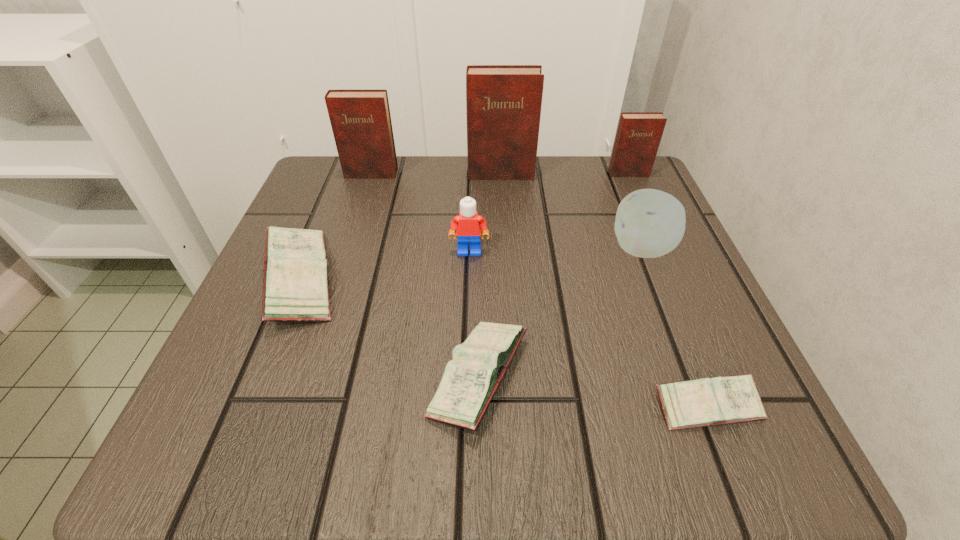
Point out which diary is positioned as the nearest to the smallest pink diary. Please provide its 2D coordinates. Your answer should be formatted as a tuple, i.e. [(x, y)], where the tuple contains the x and y coordinates of a point satisfying the conditions above.

[(469, 382)]

Locate an element on the screen. This screenshot has height=540, width=960. the fourth closest diary to the white apple is located at coordinates (702, 402).

This screenshot has width=960, height=540. I want to click on the closest reddish-brown diary relative to the tallest diary, so click(x=361, y=123).

Identify the location of reddish-brown diary that stands as the second closest to the smallest reddish-brown diary. (361, 123).

The width and height of the screenshot is (960, 540). Identify the location of pink diary object that ranks as the second closest to the seventh tallest object. (702, 402).

At what (x,y) coordinates should I click in order to perform the action: click on pink diary that is the closest to the leftmost pink diary. Please return your answer as a coordinate pair (x, y). The height and width of the screenshot is (540, 960). Looking at the image, I should click on (469, 382).

This screenshot has width=960, height=540. In order to click on free location that satisfies the following two spatial constraints: 1. on the front cover of the leftmost reddish-brown diary; 2. on the left side of the white apple in this screenshot , I will do `click(347, 249)`.

Image resolution: width=960 pixels, height=540 pixels. In order to click on vacant area that satisfies the following two spatial constraints: 1. on the front side of the shortest diary; 2. on the left side of the second smallest pink diary in this screenshot , I will do `click(479, 406)`.

This screenshot has width=960, height=540. Identify the location of free space that satisfies the following two spatial constraints: 1. on the back side of the white apple; 2. on the right side of the biggest pink diary. (x=312, y=249).

Locate an element on the screen. The height and width of the screenshot is (540, 960). free space that satisfies the following two spatial constraints: 1. on the face of the white Lego; 2. on the left side of the second shortest diary is located at coordinates (466, 377).